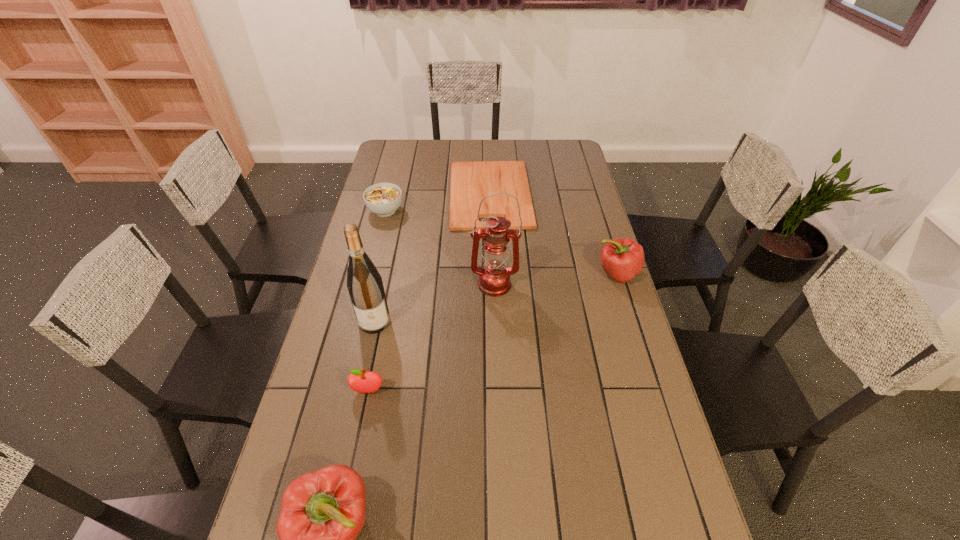
What are the coordinates of `the shorter bell pepper` in the screenshot? It's located at (623, 258).

Locate an element on the screen. The height and width of the screenshot is (540, 960). the rightmost object is located at coordinates (623, 258).

I want to click on the shortest object, so click(470, 181).

Locate an element on the screen. This screenshot has width=960, height=540. the sixth tallest object is located at coordinates (383, 199).

Where is `wine bottle`? The width and height of the screenshot is (960, 540). wine bottle is located at coordinates (364, 283).

Locate an element on the screen. The height and width of the screenshot is (540, 960). oil lamp is located at coordinates (494, 278).

Where is `the third shortest object`? the third shortest object is located at coordinates (360, 381).

This screenshot has height=540, width=960. In order to click on apple in this screenshot , I will do `click(360, 381)`.

The width and height of the screenshot is (960, 540). I want to click on vacant space situated 0.340m on the back of the farther bell pepper, so click(x=594, y=202).

Locate an element on the screen. free spot located on the left of the chopping board is located at coordinates (369, 194).